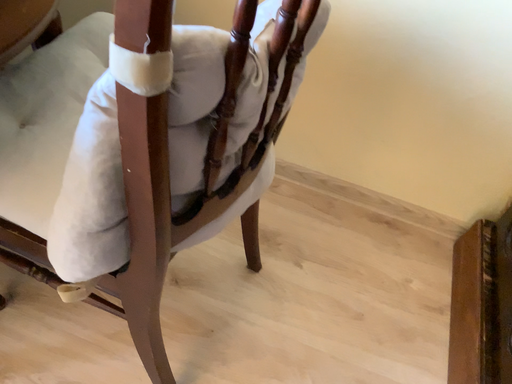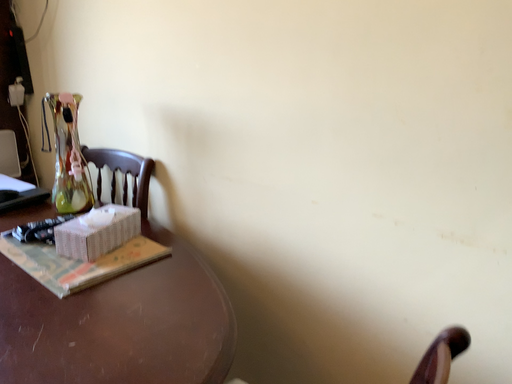
Question: How did the camera likely rotate when shooting the video?

Choices:
 (A) rotated left
 (B) rotated right

Answer: (A)